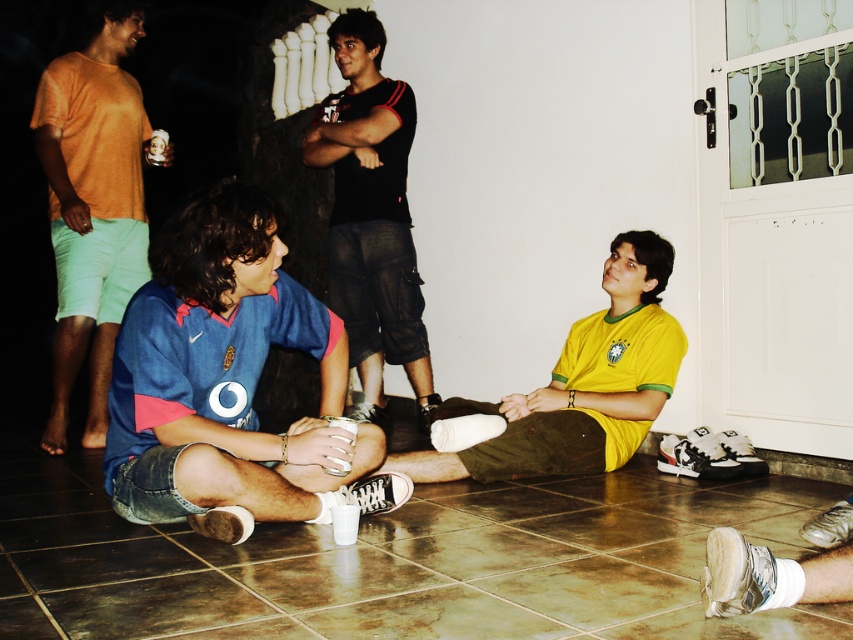
Question: Estimate the real-world distances between objects in this image. Which object is closer to the yellow jersey at center?

Choices:
 (A) blue denim shorts at center
 (B) black cotton shirt at center

Answer: (A)

Question: Estimate the real-world distances between objects in this image. Which object is farther from the black cotton shirt at center?

Choices:
 (A) matte orange t-shirt at left
 (B) blue denim shorts at center

Answer: (B)

Question: Which point is closer to the camera?

Choices:
 (A) black cotton shirt at center
 (B) yellow jersey at center

Answer: (B)

Question: Does matte orange t-shirt at left appear over black cotton shirt at center?

Choices:
 (A) no
 (B) yes

Answer: (A)

Question: Where is blue denim shorts at center located in relation to black cotton shirt at center in the image?

Choices:
 (A) above
 (B) below

Answer: (B)

Question: Does black cotton shirt at center lie in front of yellow jersey at center?

Choices:
 (A) no
 (B) yes

Answer: (A)